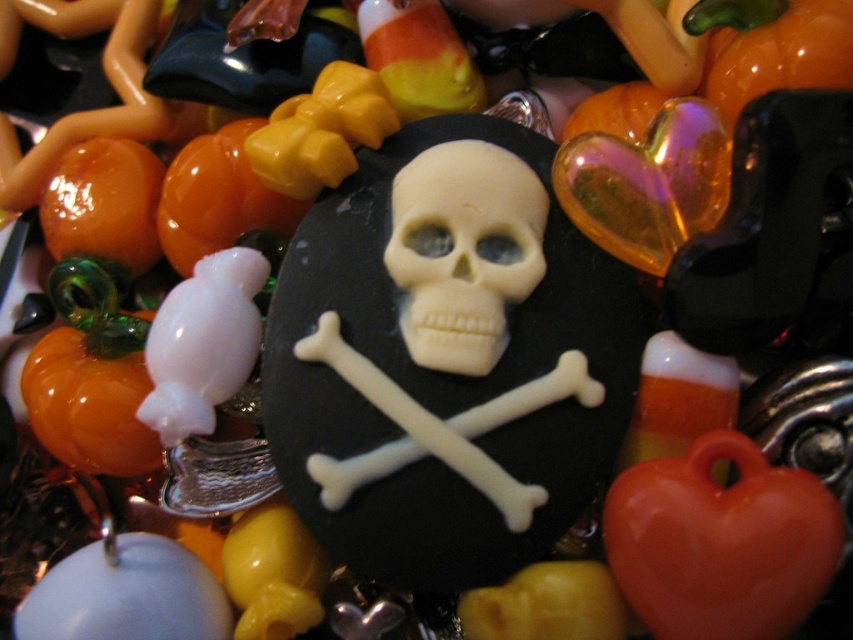
What do you see at coordinates (720, 541) in the screenshot?
I see `glossy plastic heart at lower right` at bounding box center [720, 541].

Which of these two, glossy plastic heart at lower right or white matte skull at center, stands taller?

With more height is white matte skull at center.

Between point (708, 467) and point (415, 211), which one is positioned in front?

Point (708, 467)

Find the location of a particular element. This screenshot has height=640, width=853. glossy plastic heart at lower right is located at coordinates (720, 541).